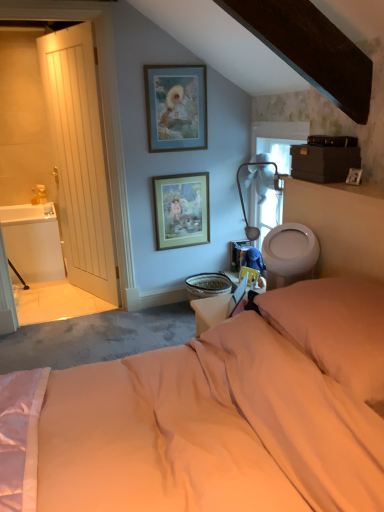
Where is `vacant space underneath white wooden door at left (from a real-world perspective)`? vacant space underneath white wooden door at left (from a real-world perspective) is located at coordinates (90, 296).